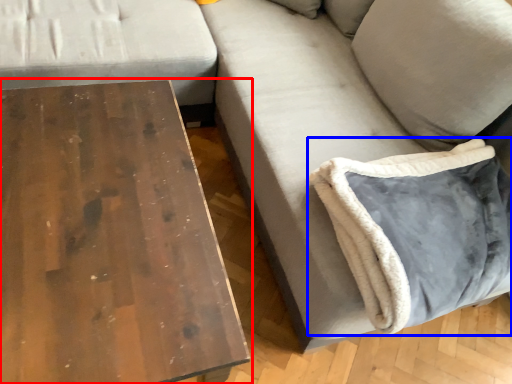
Question: Among these objects, which one is nearest to the camera, table (highlighted by a red box) or pillow (highlighted by a blue box)?

Choices:
 (A) table
 (B) pillow

Answer: (A)